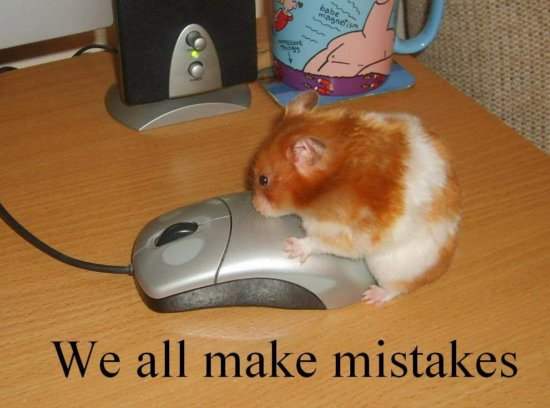
Where is `speaker`? This screenshot has height=408, width=550. speaker is located at coordinates (155, 41).